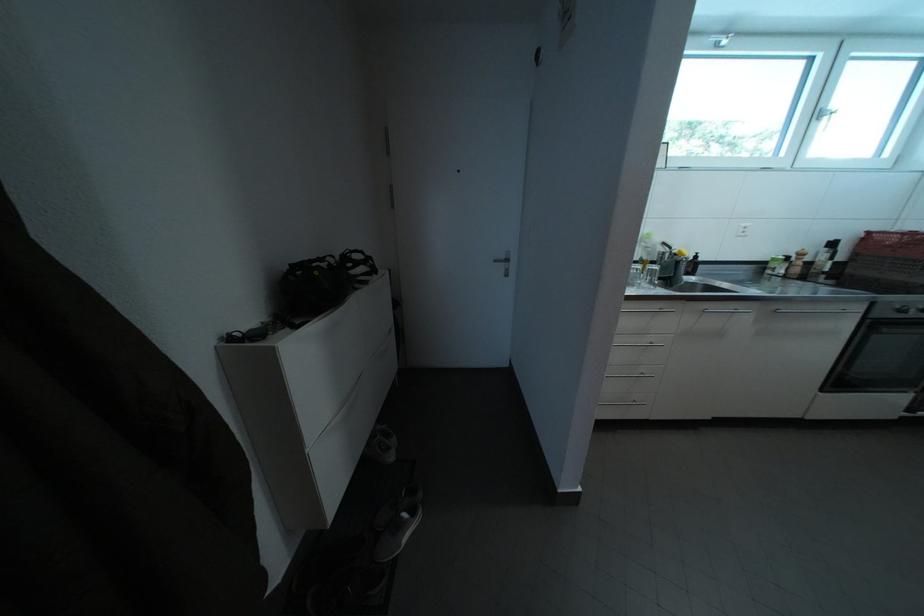
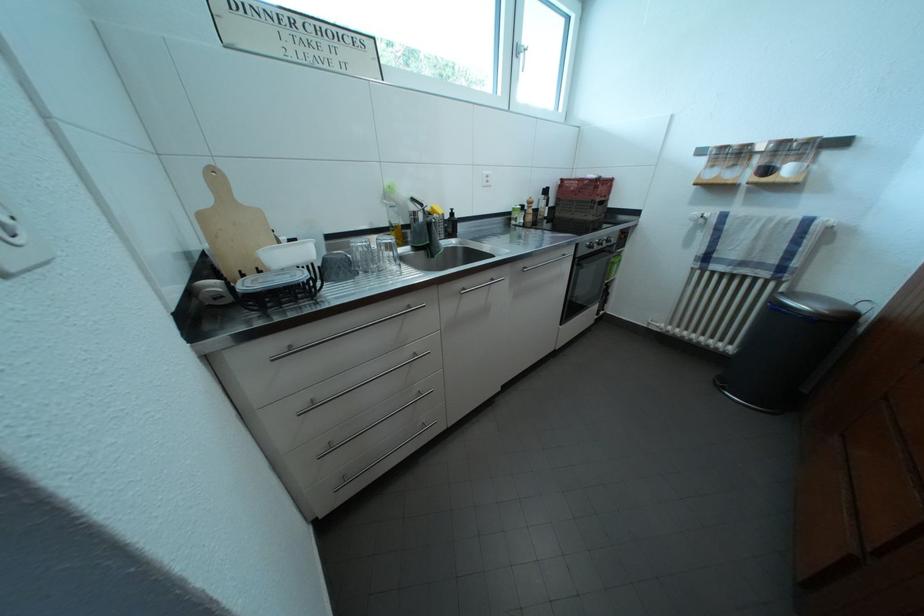
Question: The images are taken continuously from a first-person perspective. In which direction is your viewpoint rotating?

Choices:
 (A) Left
 (B) Right
 (C) Up
 (D) Down

Answer: (B)